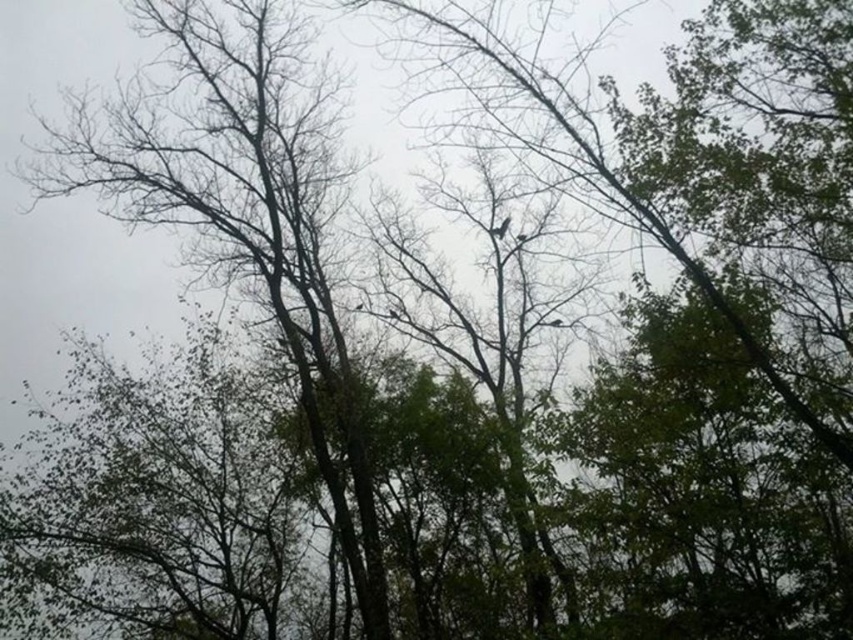
Between bare branches at center and dark brown feathered bird at center, which one has more height?

bare branches at center is taller.

Is bare branches at center further to the viewer compared to dark brown feathered bird at center?

No, it is not.

Is point (294, 76) closer to viewer compared to point (500, 225)?

Yes, point (294, 76) is closer to viewer.

At what (x,y) coordinates should I click in order to perform the action: click on bare branches at center. Please return your answer as a coordinate pair (x, y). The height and width of the screenshot is (640, 853). Looking at the image, I should click on tap(238, 205).